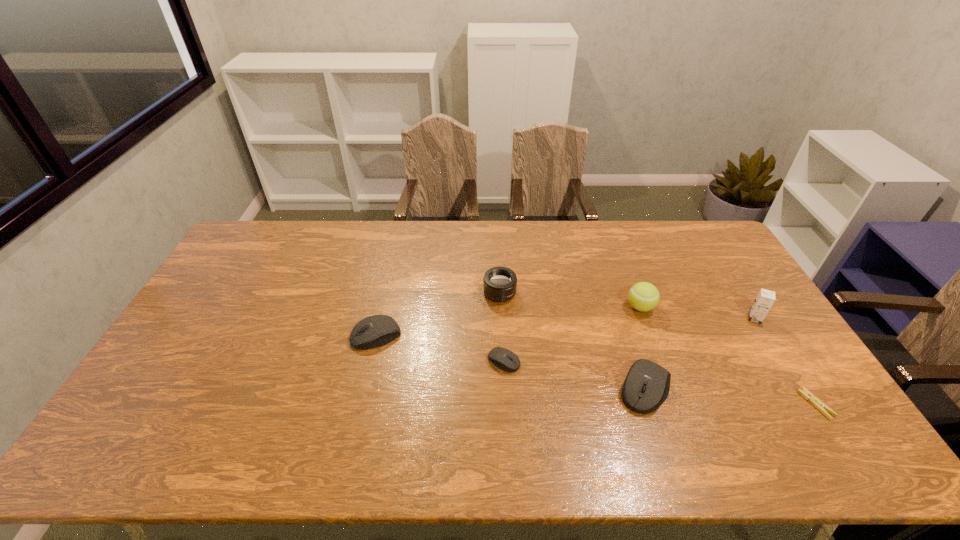
You are a GUI agent. You are given a task and a screenshot of the screen. Output one action in this format:
    pyautogui.click(x=<x>, y=<y>)
    Task: Click on the vacant space positioned 0.320m on the left of the second computer equipment from left to right
    The width and height of the screenshot is (960, 540).
    Given the screenshot: What is the action you would take?
    pyautogui.click(x=374, y=361)

In order to click on free point located 0.280m on the left of the rightmost computer equipment in this screenshot , I will do `click(513, 389)`.

This screenshot has width=960, height=540. In order to click on vacant space located on the right of the tennis ball in this screenshot , I will do [692, 307].

I want to click on free space located 0.160m on the side of the third tallest object with brand markings and control switches, so click(502, 345).

The width and height of the screenshot is (960, 540). In order to click on vacant region located on the back of the chocolate milk in this screenshot , I will do `click(734, 286)`.

At what (x,y) coordinates should I click in order to perform the action: click on vacant space located 0.380m on the back of the shortest object. Please return your answer as a coordinate pair (x, y). The image size is (960, 540). Looking at the image, I should click on (743, 291).

Identify the location of computer equipment present at the near edge. This screenshot has width=960, height=540. (647, 384).

This screenshot has width=960, height=540. In order to click on clothespin positioned at the near edge in this screenshot , I will do `click(818, 404)`.

Where is `chocolate milk that is positioned at the right edge`? The width and height of the screenshot is (960, 540). chocolate milk that is positioned at the right edge is located at coordinates (765, 299).

At what (x,y) coordinates should I click in order to perform the action: click on clothespin that is at the right edge. Please return your answer as a coordinate pair (x, y). This screenshot has width=960, height=540. Looking at the image, I should click on (818, 404).